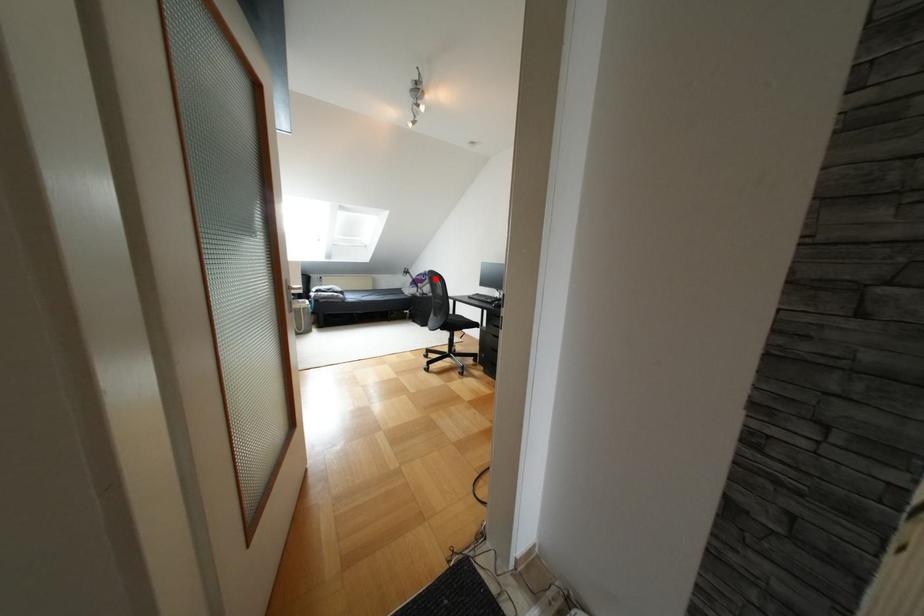
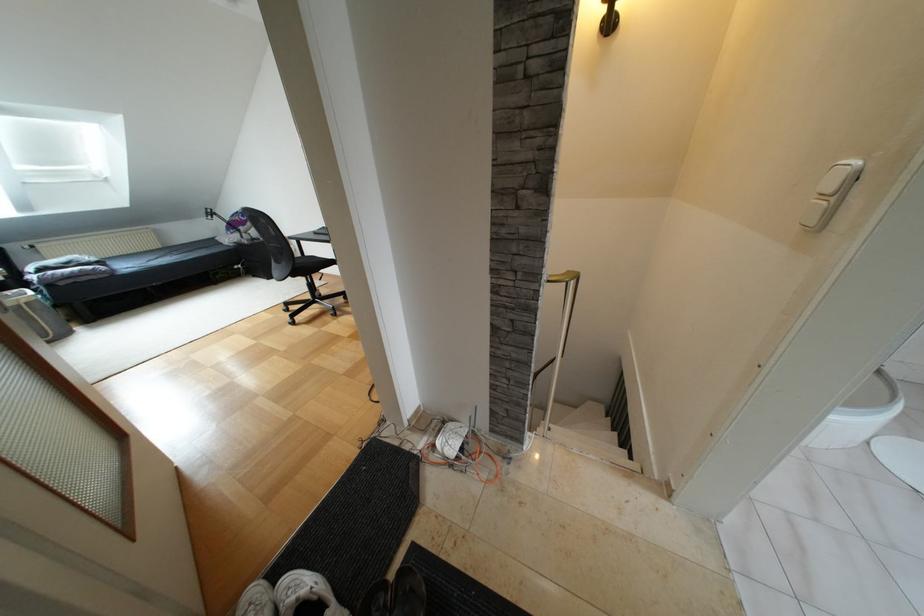
Question: I am providing you with two images of the same scene from different viewpoints. Image1 has a red point marked. In image2, the corresponding 3D location appears at what relative position? Reply with the corresponding letter.

Choices:
 (A) Closer
 (B) Farther

Answer: (A)